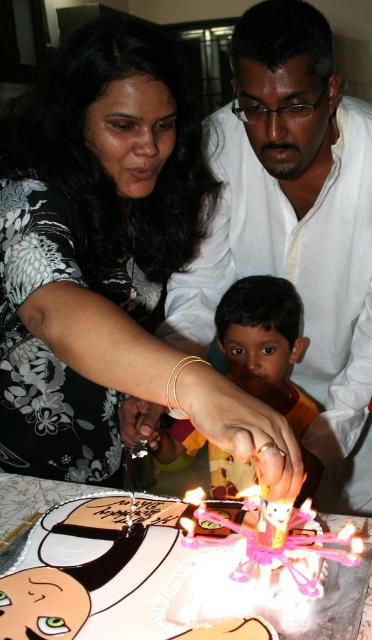
Can you confirm if white matte shirt at center is thinner than pink wax candle at center?

In fact, white matte shirt at center might be wider than pink wax candle at center.

Between point (252, 74) and point (181, 524), which one is positioned in front?

Positioned in front is point (181, 524).

Is point (332, 417) positioned in front of point (181, 525)?

That is False.

Find the location of a particular element. The image size is (372, 640). white matte shirt at center is located at coordinates (294, 228).

Between point (58, 138) and point (305, 624), which one is positioned in front?

Point (305, 624) is more forward.

Is floral-patterned dress at center wider than white fondant cake with pink candles at center?

Correct, the width of floral-patterned dress at center exceeds that of white fondant cake with pink candles at center.

Image resolution: width=372 pixels, height=640 pixels. What are the coordinates of `floral-patterned dress at center` in the screenshot? It's located at (108, 262).

Between white fondant cake with pink candles at center and pink wax candle at center, which one has more height?

Standing taller between the two is white fondant cake with pink candles at center.

Can you confirm if white fondant cake with pink candles at center is bigger than pink wax candle at center?

Correct, white fondant cake with pink candles at center is larger in size than pink wax candle at center.

The width and height of the screenshot is (372, 640). Describe the element at coordinates (95, 588) in the screenshot. I see `white fondant cake with pink candles at center` at that location.

This screenshot has width=372, height=640. What are the coordinates of `white fondant cake with pink candles at center` in the screenshot? It's located at (95, 588).